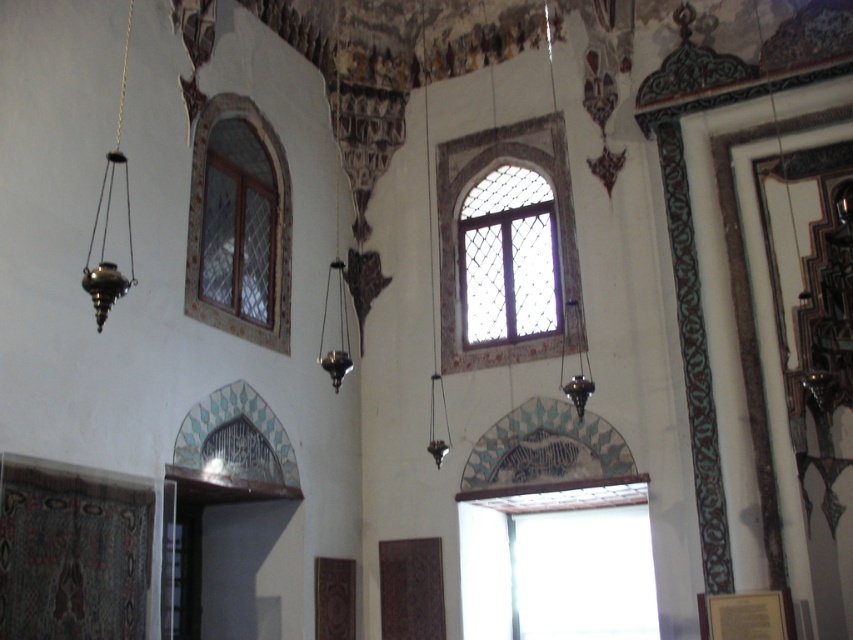
Question: Among these points, which one is farthest from the camera?

Choices:
 (A) (242, 300)
 (B) (96, 547)
 (C) (131, 273)
 (D) (618, 621)

Answer: (D)

Question: Considering the real-world distances, which object is closest to the metallic hanging lamp at center?

Choices:
 (A) brass/metallic lamp at left
 (B) textured woolen tapestry at lower left

Answer: (A)

Question: Which of the following is the farthest from the observer?

Choices:
 (A) textured woolen tapestry at lower left
 (B) dark brown wooden window at center
 (C) metallic hanging lamp at center
 (D) clear glass window at upper center

Answer: (C)

Question: Can you confirm if textured woolen tapestry at lower left is positioned below metallic hanging lamp at center?

Choices:
 (A) yes
 (B) no

Answer: (A)

Question: Is transparent glass window at center thinner than dark brown wooden window at center?

Choices:
 (A) yes
 (B) no

Answer: (B)

Question: Is clear glass window at upper center below brass/metallic lamp at left?

Choices:
 (A) no
 (B) yes

Answer: (A)